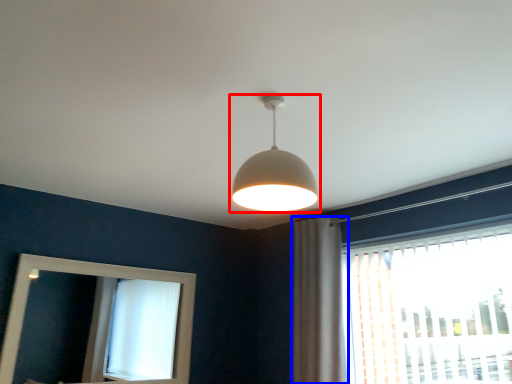
Question: Which of the following is the closest to the observer, lamp (highlighted by a red box) or curtain (highlighted by a blue box)?

Choices:
 (A) lamp
 (B) curtain

Answer: (A)